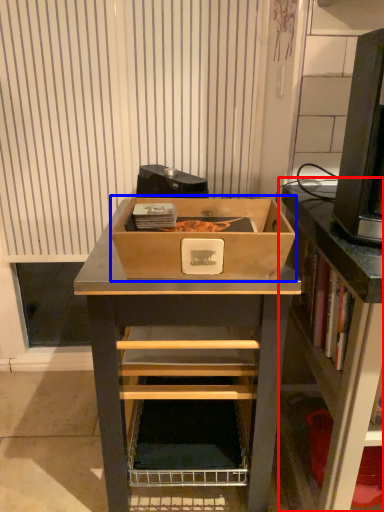
Question: Which object is closer to the camera taking this photo, shelf (highlighted by a red box) or box (highlighted by a blue box)?

Choices:
 (A) shelf
 (B) box

Answer: (A)